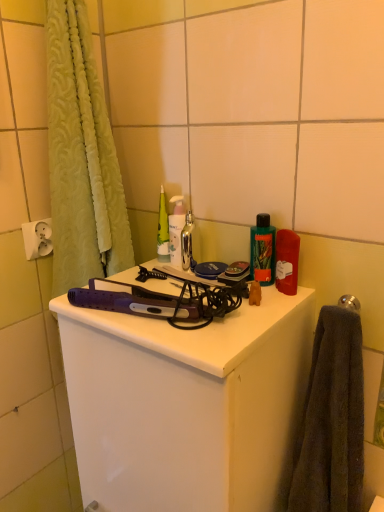
Question: In terms of width, does dark gray towel at right look wider or thinner when compared to purple plastic hair straightener at center?

Choices:
 (A) thin
 (B) wide

Answer: (A)

Question: Is dark gray towel at right to the left or to the right of purple plastic hair straightener at center in the image?

Choices:
 (A) right
 (B) left

Answer: (A)

Question: Estimate the real-world distances between objects in this image. Which object is closer to the polished silver towel bar at upper right?

Choices:
 (A) white plastic electric outlet at upper left
 (B) dark gray towel at right
 (C) green plastic bottle at upper right, acting as the second toiletry starting from the back
 (D) shiny metallic faucet at center
 (E) metallic silver bottle at center, which is the second toiletry from right to left

Answer: (C)

Question: Considering the real-world distances, which object is closest to the purple plastic hair straightener at center?

Choices:
 (A) dark gray towel at right
 (B) polished silver towel bar at upper right
 (C) metallic silver bottle at center, the 2th toiletry from the front
 (D) shiny metallic faucet at center
 (E) white plastic electric outlet at upper left

Answer: (A)